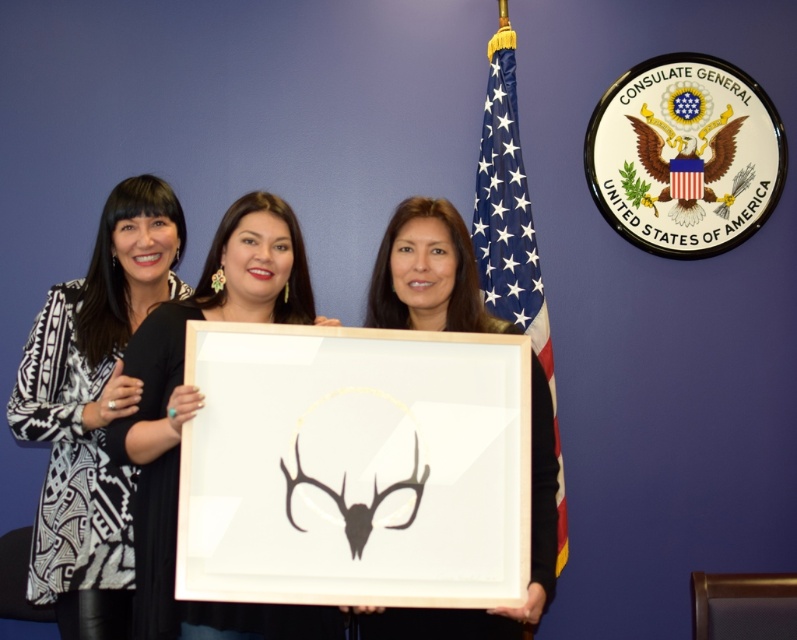
Based on the scene description, which object is positioned to the left when looking at the matte black frame at center and the american flag at center?

The matte black frame at center is to the left of the american flag at center.

You are an interior designer arranging a gallery wall. You have a matte black frame at center and an american flag at center. Which object should you place higher up on the wall to ensure the smaller one is positioned above the larger one?

The matte black frame at center is smaller than the american flag at center, so you should place the matte black frame at center higher up on the wall above the american flag at center to meet the requirement.

You are an interior designer who needs to determine the arrangement of objects in the image. Based on the scene, which object, the black printed fabric at left or the matte black frame at center, takes up more space in the image?

The black printed fabric at left is larger in size than the matte black frame at center, so it takes up more space in the image.